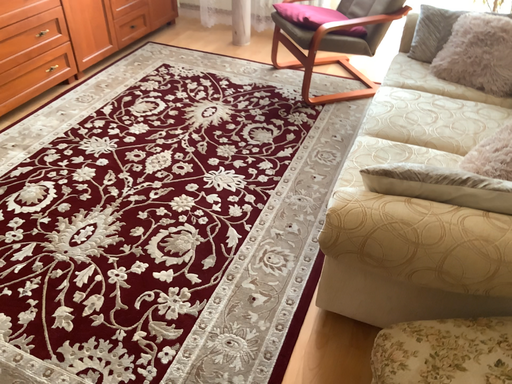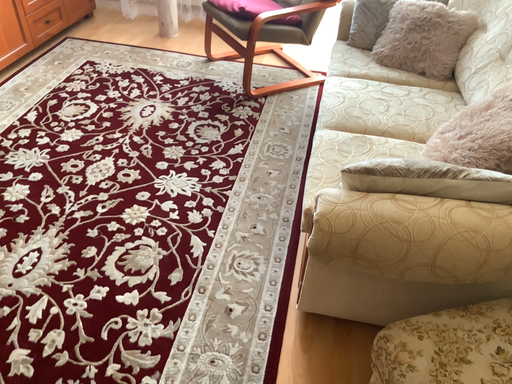
Question: How did the camera likely rotate when shooting the video?

Choices:
 (A) rotated left
 (B) rotated right

Answer: (B)